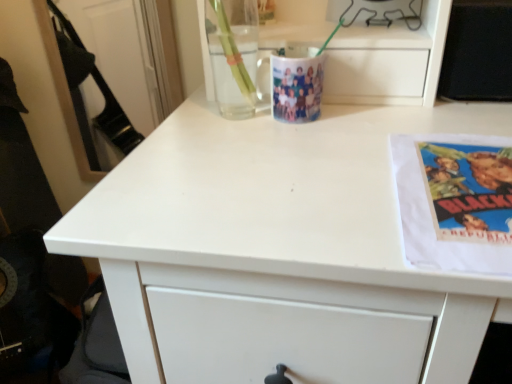
You are a GUI agent. You are given a task and a screenshot of the screen. Output one action in this format:
    pyautogui.click(x=<x>, y=<y>)
    Task: Click on the free location above white paper at right (from a real-world perspective)
    
    Given the screenshot: What is the action you would take?
    pyautogui.click(x=468, y=172)